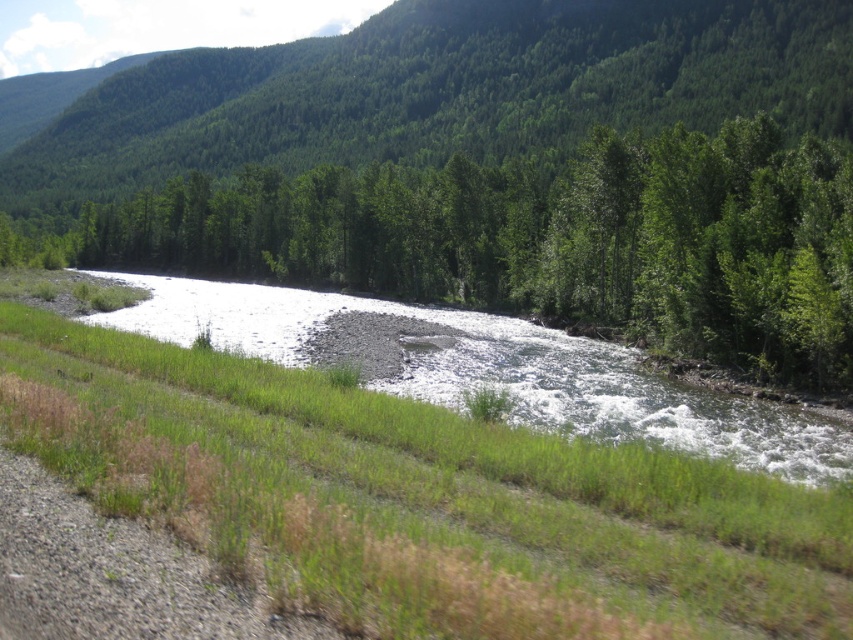
Question: Which point is farther from the camera taking this photo?

Choices:
 (A) (291, 310)
 (B) (624, 12)
 (C) (368, 182)

Answer: (B)

Question: Estimate the real-world distances between objects in this image. Which object is closer to the green leafy tree at upper center?

Choices:
 (A) white gravel river at center
 (B) green leafy tree at center

Answer: (B)

Question: Is green leafy tree at upper center closer to camera compared to white gravel river at center?

Choices:
 (A) yes
 (B) no

Answer: (B)

Question: In this image, where is green leafy tree at center located relative to white gravel river at center?

Choices:
 (A) above
 (B) below

Answer: (A)

Question: Which point is farther to the camera?

Choices:
 (A) green leafy tree at upper center
 (B) green leafy tree at center
 (C) white gravel river at center

Answer: (A)

Question: Does green leafy tree at center have a greater width compared to green leafy tree at upper center?

Choices:
 (A) no
 (B) yes

Answer: (A)